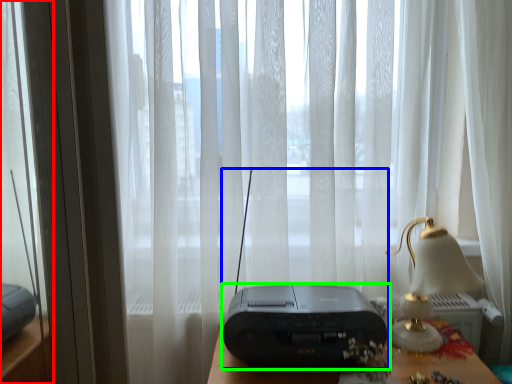
Question: Estimate the real-world distances between objects in this image. Which object is closer to glass door (highlighted by a red box), gadget (highlighted by a blue box) or printer (highlighted by a green box)?

Choices:
 (A) gadget
 (B) printer

Answer: (A)